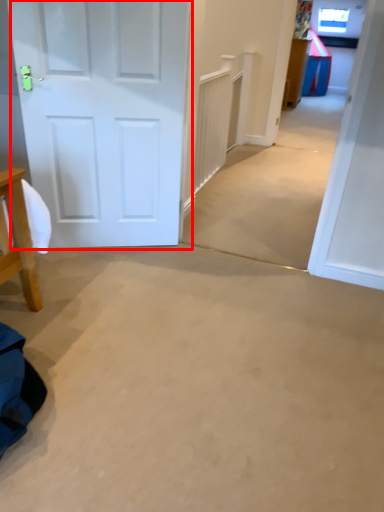
Question: From the image's perspective, where is door (annotated by the red box) located relative to table?

Choices:
 (A) above
 (B) below

Answer: (B)